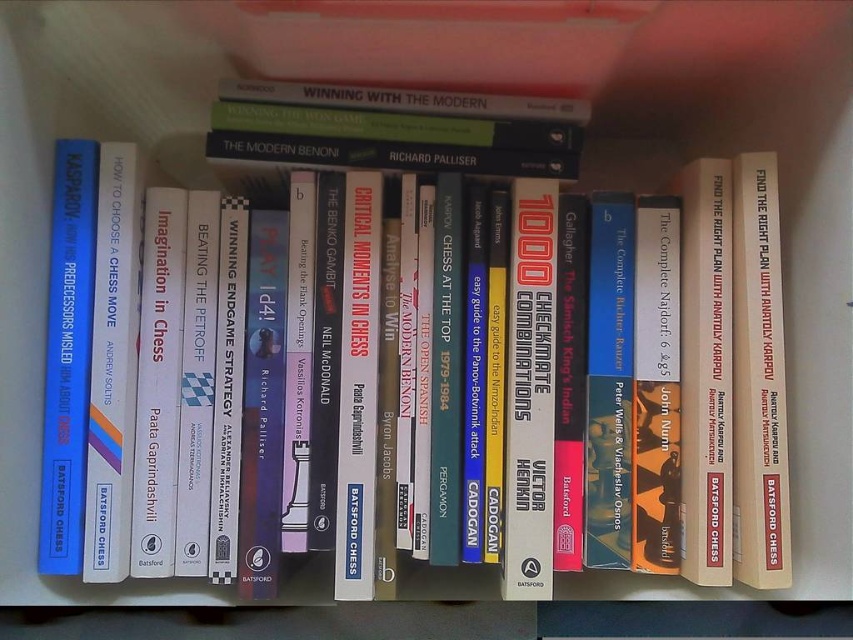
Question: Which of the following is the farthest from the observer?

Choices:
 (A) (717, 435)
 (B) (743, 460)

Answer: (A)

Question: Which point is closer to the camera?

Choices:
 (A) (724, 346)
 (B) (755, 202)

Answer: (A)

Question: Is white matte book at center-right behind hardcover book at center?

Choices:
 (A) yes
 (B) no

Answer: (B)

Question: Which point is closer to the camera taking this photo?

Choices:
 (A) (695, 394)
 (B) (759, 256)

Answer: (B)

Question: Can you confirm if white matte book at center-right is smaller than hardcover book at center?

Choices:
 (A) no
 (B) yes

Answer: (B)

Question: Does white matte book at center-right have a lesser width compared to hardcover book at center?

Choices:
 (A) no
 (B) yes

Answer: (B)